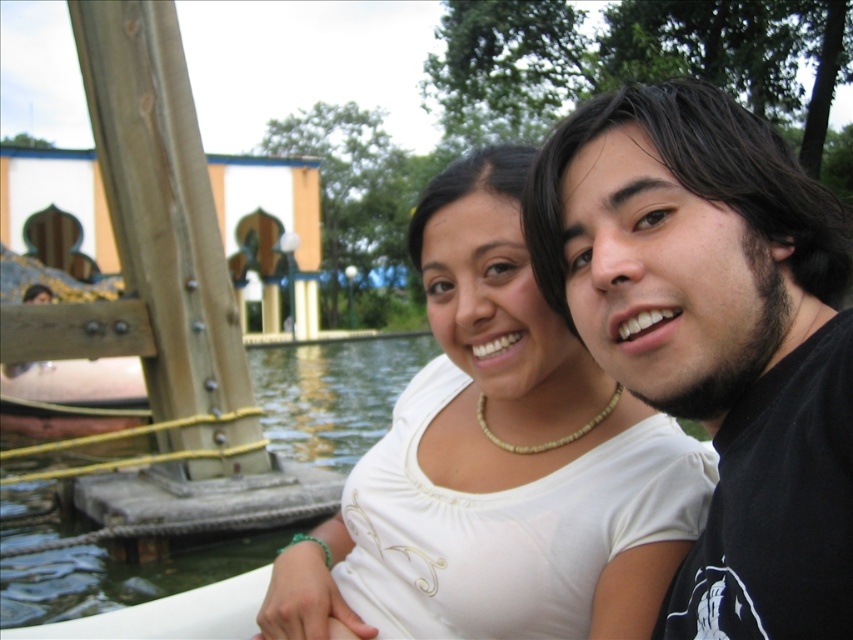
Question: Which point is closer to the camera?

Choices:
 (A) (361, 461)
 (B) (717, 196)

Answer: (B)

Question: Can you confirm if black matte shirt at upper right is smaller than white matte shirt at center?

Choices:
 (A) yes
 (B) no

Answer: (A)

Question: Which object appears farthest from the camera in this image?

Choices:
 (A) black matte shirt at upper right
 (B) white matte shirt at center

Answer: (B)

Question: Is black matte shirt at upper right to the left of white matte shirt at center from the viewer's perspective?

Choices:
 (A) yes
 (B) no

Answer: (B)

Question: Can you confirm if black matte shirt at upper right is positioned below white matte shirt at center?

Choices:
 (A) no
 (B) yes

Answer: (A)